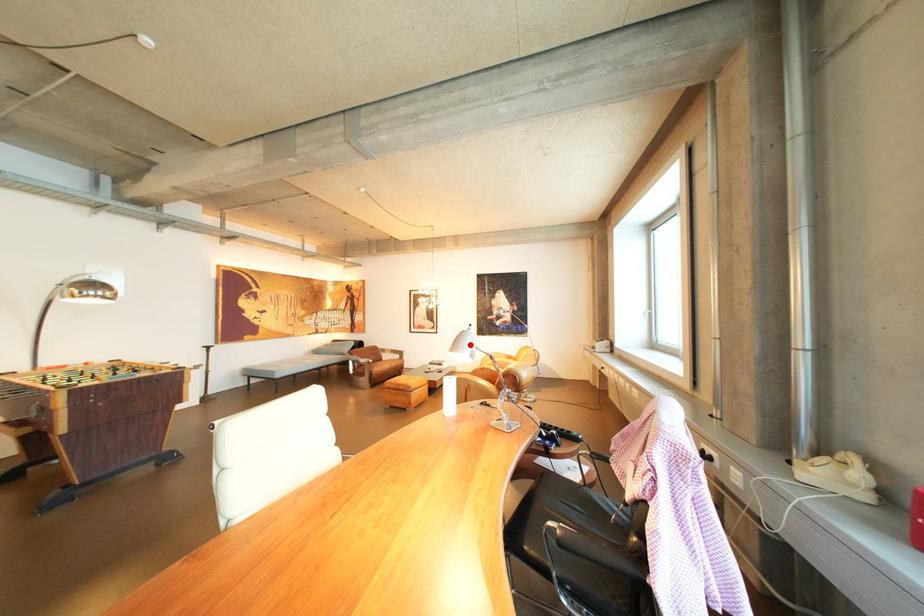
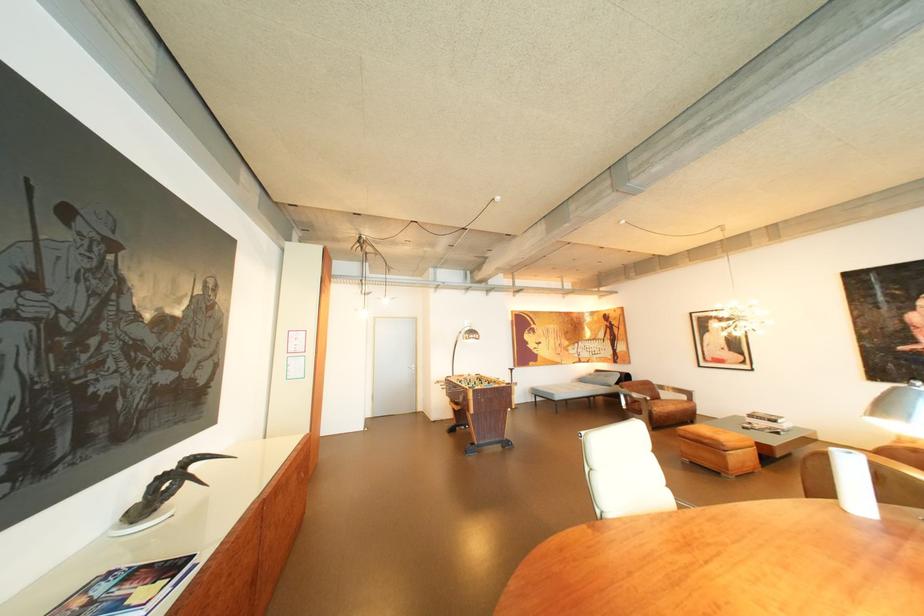
Question: I am providing you with two images of the same scene from different viewpoints. In image1, a red point is highlighted. Considering the same 3D point in image2, which of the following is correct?

Choices:
 (A) It is closer
 (B) It is farther

Answer: (A)